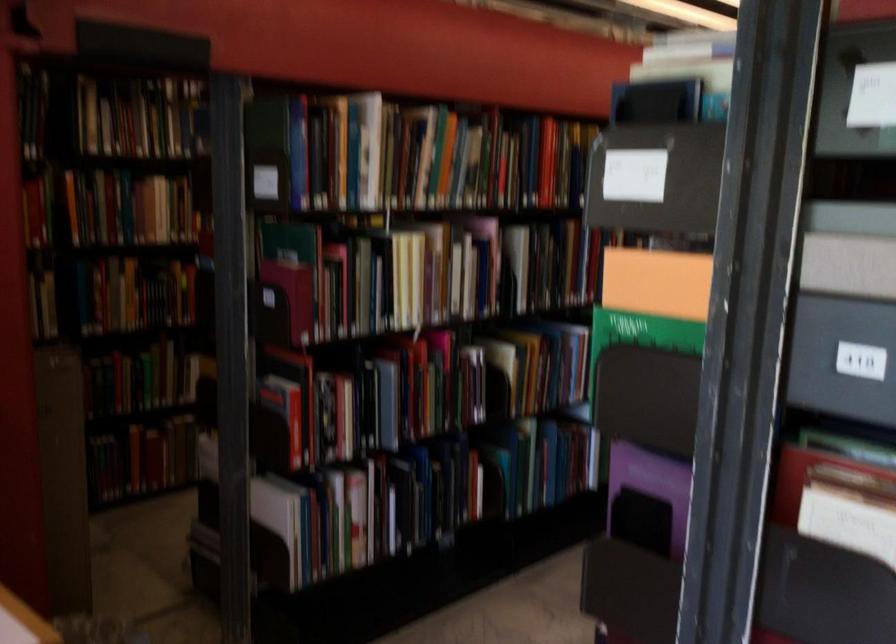
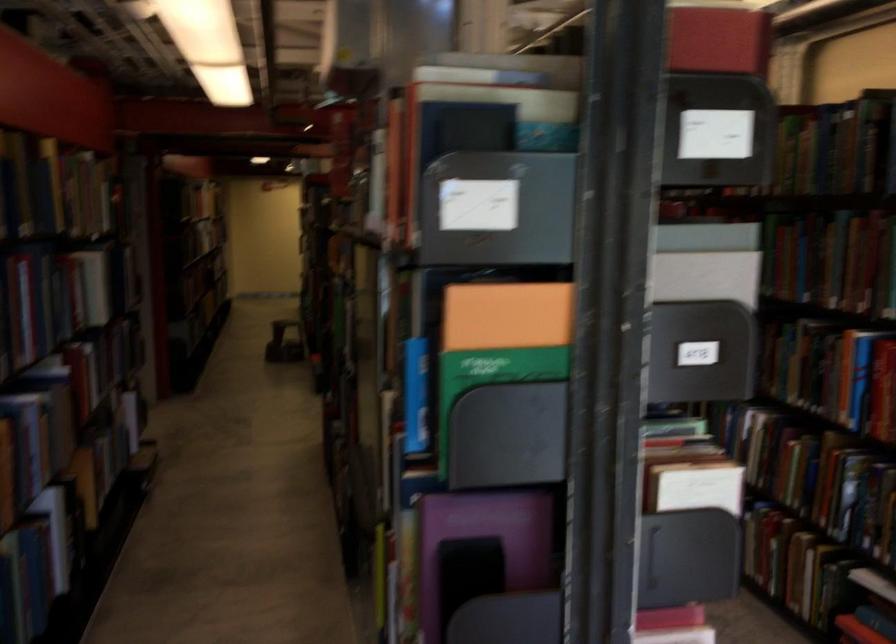
The point at (676, 496) is marked in the first image. Where is the corresponding point in the second image?

(489, 532)